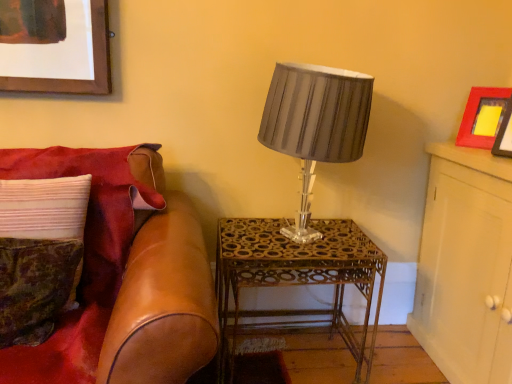
Where is `white wood cabinet at upper right`? white wood cabinet at upper right is located at coordinates (463, 261).

What do you see at coordinates (44, 208) in the screenshot?
I see `white textured pillow at left, which is the 1th pillow in back-to-front order` at bounding box center [44, 208].

What do you see at coordinates (122, 272) in the screenshot?
I see `leather couch at left` at bounding box center [122, 272].

The width and height of the screenshot is (512, 384). Describe the element at coordinates (34, 287) in the screenshot. I see `velvet green pillow at left, which ranks as the second pillow in back-to-front order` at that location.

What is the approximate width of gold metallic table at center?

gold metallic table at center is 16.89 inches wide.

This screenshot has height=384, width=512. What do you see at coordinates (315, 124) in the screenshot?
I see `matte gray fabric lampshade at center` at bounding box center [315, 124].

In order to click on white wood cabinet at upper right in this screenshot , I will do `click(463, 261)`.

From a real-world perspective, is white wood cabinet at upper right located higher than matte red picture frame at upper right?

No.

Is white wood cabinet at upper right facing towards matte red picture frame at upper right?

No, white wood cabinet at upper right is not aimed at matte red picture frame at upper right.

Is white wood cabinet at upper right positioned beyond the bounds of matte red picture frame at upper right?

Yes, white wood cabinet at upper right is located beyond the bounds of matte red picture frame at upper right.

Which is in front, point (456, 306) or point (476, 131)?

The point (476, 131) is closer to the camera.

In the scene shown: Could you tell me if gold metallic table at center is facing matte red picture frame at upper right?

No.

Is gold metallic table at center with matte red picture frame at upper right?

No, gold metallic table at center is not touching matte red picture frame at upper right.

Is gold metallic table at center closer to the viewer compared to matte red picture frame at upper right?

No, gold metallic table at center is further to the viewer.

Who is smaller, gold metallic table at center or matte red picture frame at upper right?

Smaller between the two is matte red picture frame at upper right.

Considering the relative sizes of white textured pillow at left, arranged as the 2th pillow when viewed from the front, and matte red picture frame at upper right in the image provided, is white textured pillow at left, arranged as the 2th pillow when viewed from the front, shorter than matte red picture frame at upper right?

In fact, white textured pillow at left, arranged as the 2th pillow when viewed from the front, may be taller than matte red picture frame at upper right.

Starting from the matte red picture frame at upper right, which pillow is the 1st one in front? Please provide its 2D coordinates.

[(44, 208)]

Is white textured pillow at left, arranged as the 2th pillow when viewed from the front, far from matte red picture frame at upper right?

white textured pillow at left, arranged as the 2th pillow when viewed from the front, is far away from matte red picture frame at upper right.

Is matte red picture frame at upper right surrounded by white textured pillow at left, arranged as the 2th pillow when viewed from the front?

No, matte red picture frame at upper right is not surrounded by white textured pillow at left, arranged as the 2th pillow when viewed from the front.

Is point (6, 342) farther from viewer compared to point (489, 108)?

No, (6, 342) is closer to viewer.

Is there a large distance between velvet green pillow at left, which ranks as the second pillow in back-to-front order, and matte red picture frame at upper right?

That's right, there is a large distance between velvet green pillow at left, which ranks as the second pillow in back-to-front order, and matte red picture frame at upper right.

Can you confirm if velvet green pillow at left, which ranks as the second pillow in back-to-front order, is shorter than matte red picture frame at upper right?

Incorrect, the height of velvet green pillow at left, which ranks as the second pillow in back-to-front order, does not fall short of that of matte red picture frame at upper right.

How many degrees apart are the facing directions of velvet green pillow at left, placed as the first pillow when sorted from front to back, and matte red picture frame at upper right?

The facing directions of velvet green pillow at left, placed as the first pillow when sorted from front to back, and matte red picture frame at upper right are 59.9 degrees apart.

From a real-world perspective, who is located higher, gold metallic table at center or white textured pillow at left, which is the 1th pillow in back-to-front order?

white textured pillow at left, which is the 1th pillow in back-to-front order.

Is gold metallic table at center wider or thinner than white textured pillow at left, arranged as the 2th pillow when viewed from the front?

Considering their sizes, gold metallic table at center looks broader than white textured pillow at left, arranged as the 2th pillow when viewed from the front.

Can we say gold metallic table at center lies outside white textured pillow at left, which is the 1th pillow in back-to-front order?

Yes, gold metallic table at center is outside of white textured pillow at left, which is the 1th pillow in back-to-front order.

Is gold metallic table at center aimed at white textured pillow at left, arranged as the 2th pillow when viewed from the front?

No, gold metallic table at center does not turn towards white textured pillow at left, arranged as the 2th pillow when viewed from the front.

Does matte red picture frame at upper right have a lesser width compared to white textured pillow at left, which is the 1th pillow in back-to-front order?

Yes, matte red picture frame at upper right is thinner than white textured pillow at left, which is the 1th pillow in back-to-front order.

From a real-world perspective, which is physically above, matte red picture frame at upper right or white textured pillow at left, which is the 1th pillow in back-to-front order?

From a 3D spatial view, matte red picture frame at upper right is above.

Looking at this image, how much distance is there between matte red picture frame at upper right and white textured pillow at left, which is the 1th pillow in back-to-front order?

matte red picture frame at upper right is 4.96 feet away from white textured pillow at left, which is the 1th pillow in back-to-front order.

Is matte red picture frame at upper right placed right next to white textured pillow at left, which is the 1th pillow in back-to-front order?

matte red picture frame at upper right and white textured pillow at left, which is the 1th pillow in back-to-front order, are clearly separated.

Is matte red picture frame at upper right surrounding velvet green pillow at left, placed as the first pillow when sorted from front to back?

Actually, velvet green pillow at left, placed as the first pillow when sorted from front to back, is outside matte red picture frame at upper right.

The width and height of the screenshot is (512, 384). Find the location of `picture frame lying behind the velvet green pillow at left, placed as the first pillow when sorted from front to back`. picture frame lying behind the velvet green pillow at left, placed as the first pillow when sorted from front to back is located at coordinates (483, 117).

From the image's perspective, is matte red picture frame at upper right under velvet green pillow at left, which ranks as the second pillow in back-to-front order?

No.

From a real-world perspective, is matte red picture frame at upper right located beneath velvet green pillow at left, placed as the first pillow when sorted from front to back?

Actually, matte red picture frame at upper right is physically above velvet green pillow at left, placed as the first pillow when sorted from front to back, in the real world.

You are a GUI agent. You are given a task and a screenshot of the screen. Output one action in this format:
    pyautogui.click(x=<x>, y=<y>)
    Task: Click on the picture frame located above the white wood cabinet at upper right (from the image's perspective)
    The height and width of the screenshot is (384, 512).
    Given the screenshot: What is the action you would take?
    pyautogui.click(x=483, y=117)

What are the coordinates of `nightstand that appears below the matte red picture frame at upper right (from a real-world perspective)` in the screenshot? It's located at (294, 278).

When comparing their distances from white textured pillow at left, arranged as the 2th pillow when viewed from the front, does matte red picture frame at upper right or velvet green pillow at left, which ranks as the second pillow in back-to-front order, seem closer?

Based on the image, velvet green pillow at left, which ranks as the second pillow in back-to-front order, appears to be nearer to white textured pillow at left, arranged as the 2th pillow when viewed from the front.

Based on their spatial positions, is matte red picture frame at upper right or leather couch at left further from matte gray fabric lampshade at center?

matte red picture frame at upper right is further to matte gray fabric lampshade at center.

Based on their spatial positions, is white wood cabinet at upper right or velvet green pillow at left, which ranks as the second pillow in back-to-front order, further from matte red picture frame at upper right?

velvet green pillow at left, which ranks as the second pillow in back-to-front order.

Which object lies further to the anchor point gold metallic table at center, white textured pillow at left, which is the 1th pillow in back-to-front order, or matte gray fabric lampshade at center?

white textured pillow at left, which is the 1th pillow in back-to-front order.

Which object lies further to the anchor point gold metallic table at center, white textured pillow at left, arranged as the 2th pillow when viewed from the front, or matte red picture frame at upper right?

Based on the image, matte red picture frame at upper right appears to be further to gold metallic table at center.

Estimate the real-world distances between objects in this image. Which object is closer to white wood cabinet at upper right, matte gray fabric lampshade at center or white textured pillow at left, which is the 1th pillow in back-to-front order?

matte gray fabric lampshade at center is positioned closer to the anchor white wood cabinet at upper right.

From the image, which object appears to be nearer to gold metallic table at center, leather couch at left or velvet green pillow at left, which ranks as the second pillow in back-to-front order?

leather couch at left is closer to gold metallic table at center.

Based on their spatial positions, is matte red picture frame at upper right or white textured pillow at left, arranged as the 2th pillow when viewed from the front, closer to gold metallic table at center?

white textured pillow at left, arranged as the 2th pillow when viewed from the front, is positioned closer to the anchor gold metallic table at center.

You are a GUI agent. You are given a task and a screenshot of the screen. Output one action in this format:
    pyautogui.click(x=<x>, y=<y>)
    Task: Click on the pillow between white textured pillow at left, which is the 1th pillow in back-to-front order, and matte red picture frame at upper right from left to right
    
    Given the screenshot: What is the action you would take?
    pyautogui.click(x=34, y=287)

The width and height of the screenshot is (512, 384). Identify the location of pillow between white textured pillow at left, arranged as the 2th pillow when viewed from the front, and matte gray fabric lampshade at center from left to right. (34, 287).

Find the location of a particular element. picture frame located between white textured pillow at left, which is the 1th pillow in back-to-front order, and white wood cabinet at upper right in the left-right direction is located at coordinates (483, 117).

This screenshot has width=512, height=384. Identify the location of nightstand between velvet green pillow at left, which ranks as the second pillow in back-to-front order, and matte gray fabric lampshade at center, in the horizontal direction. (294, 278).